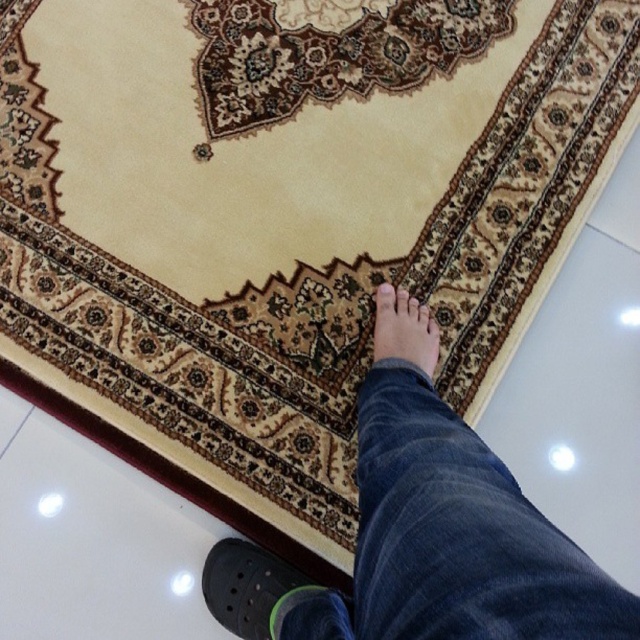
Based on the photo, you are standing in a room with a patterned rug and want to place a small decorative item exactly 20 inches away from your current position. If you are at the point labeled point [480,612], will placing the item at your current position work?

The distance between point [480,612] and the viewer is 19.77 inches, so placing the item at point [480,612] would be slightly closer than the desired 20 inches. You need to move it a bit further away from your current position to reach the exact 20 inches.

You are designing a shoe display and need to ensure that the shoes will be visible under the denim jeans at center. Based on the scene, can the shoes on the matte black foot at lower center be seen from below the jeans?

The denim jeans at center has a greater height compared to the matte black foot at lower center, so the shoes on the matte black foot at lower center would be mostly covered by the jeans and not fully visible from below.